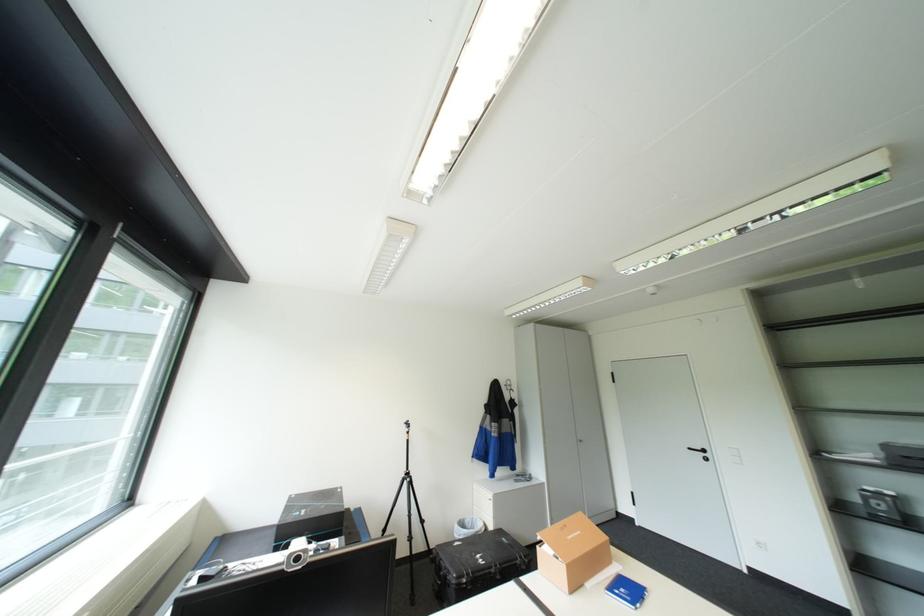
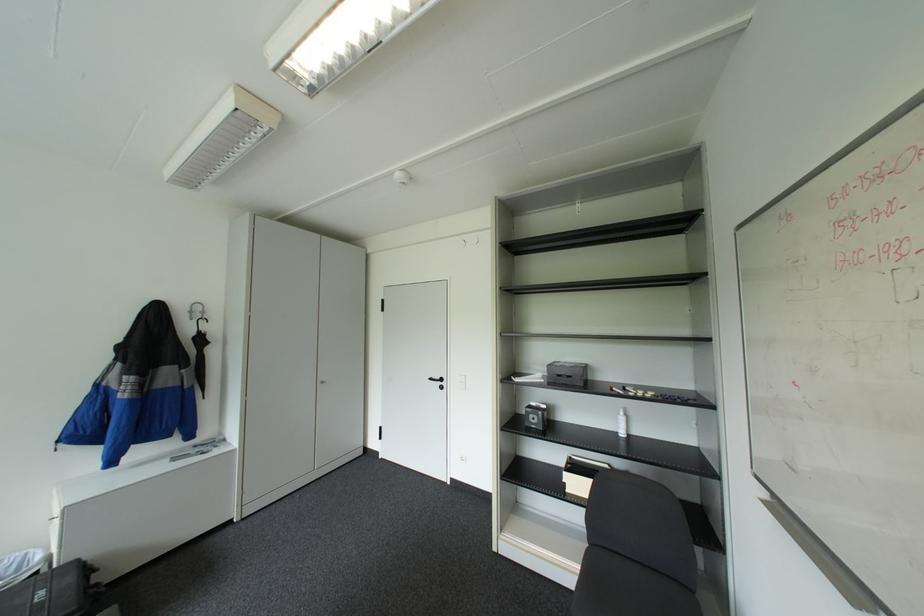
The point at (886, 460) is marked in the first image. Where is the corresponding point in the second image?

(551, 379)